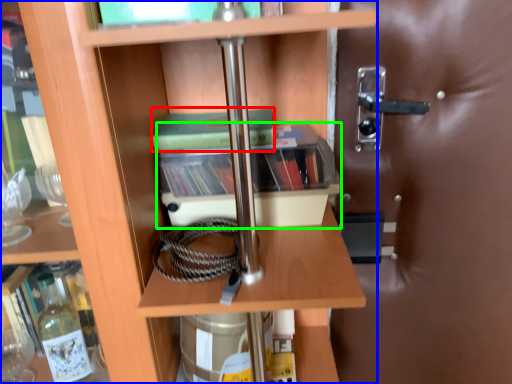
Question: Which object is positioned farthest from paperback book (highlighted by a red box)? Select from shelf (highlighted by a blue box) and cabinetry (highlighted by a green box).

Choices:
 (A) shelf
 (B) cabinetry

Answer: (A)